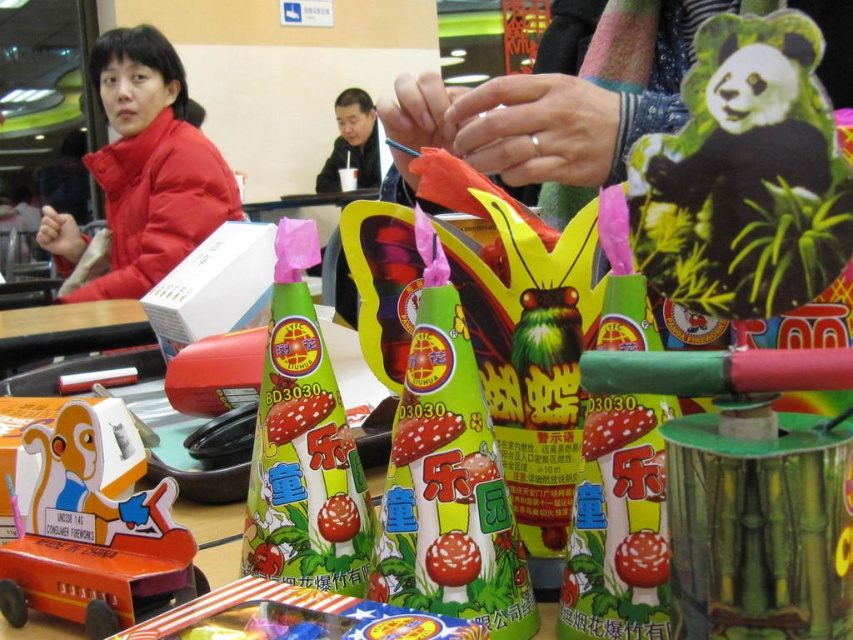
You are a customer at the fireworks store and want to pick up the green matte toy at center. Which direction should you move relative to the matte red jacket at upper left?

The green matte toy at center is positioned under the matte red jacket at upper left, so you should move downward from the matte red jacket at upper left to reach the green matte toy at center.

You are a customer at this fireworks store and want to place a toy on the shelf between the black plush panda at upper right and the green matte toy at center. Can you tell me which direction you should move the toy to position it correctly?

The black plush panda at upper right is to the right of the green matte toy at center, so to place the toy between them, you should move it to the left of the black plush panda at upper right and to the right of the green matte toy at center.

You are a photographer standing at the market entrance and want to take a closeup photo of the black plush panda at upper right. The camera requires the subject to be at least 10 inches away to focus properly. Can you take the photo without moving the panda?

The black plush panda at upper right is only 9.77 inches away from the camera, which is less than the required 10 inches. Therefore, you cannot take the photo without moving the panda closer or adjusting the camera settings.